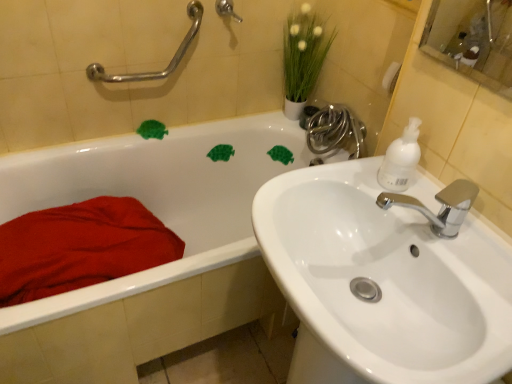
Locate an element on the screen. Image resolution: width=512 pixels, height=384 pixels. vacant area that lies in front of white matte soap dispenser at upper right is located at coordinates (440, 238).